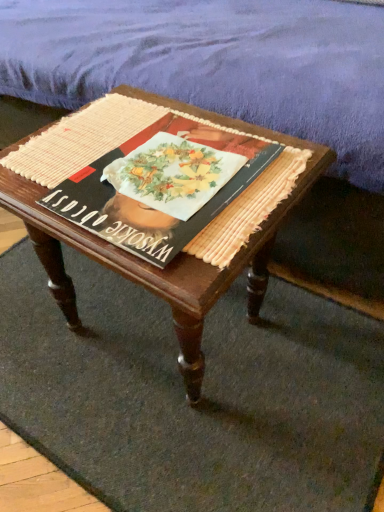
Identify the location of vacant point above woven beige doormat at center (from a real-world perspective). (166, 364).